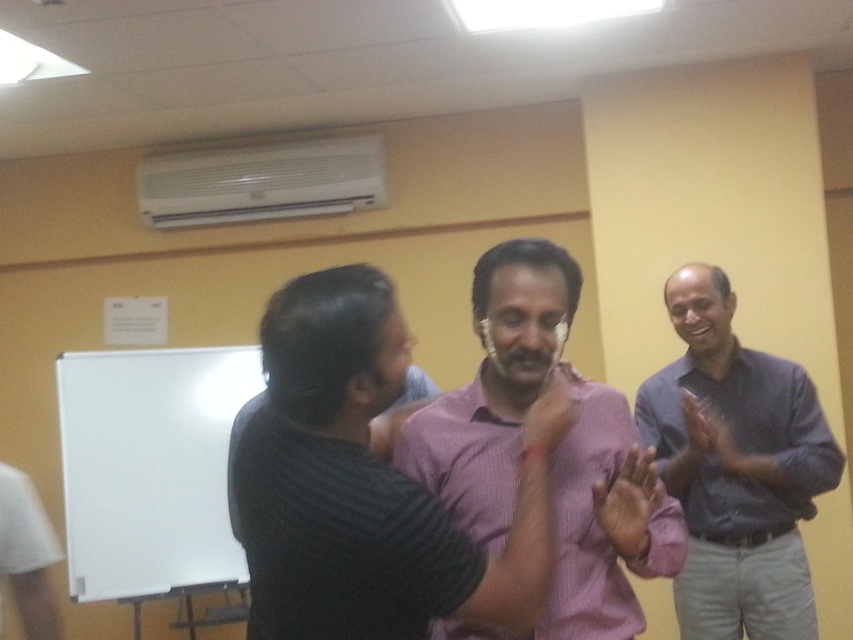
Question: Which point is closer to the camera?

Choices:
 (A) gray shirt at right
 (B) pink striped shirt at center
 (C) pink textured shirt at center

Answer: (B)

Question: Which of the following is the closest to the observer?

Choices:
 (A) pink textured shirt at center
 (B) gray shirt at right
 (C) pink striped shirt at center

Answer: (C)

Question: Is the position of pink striped shirt at center more distant than that of pink textured shirt at center?

Choices:
 (A) yes
 (B) no

Answer: (B)

Question: Estimate the real-world distances between objects in this image. Which object is closer to the pink striped shirt at center?

Choices:
 (A) pink textured shirt at center
 (B) gray shirt at right

Answer: (A)

Question: Can you confirm if pink striped shirt at center is bigger than pink textured shirt at center?

Choices:
 (A) yes
 (B) no

Answer: (A)

Question: Can you confirm if pink striped shirt at center is smaller than pink textured shirt at center?

Choices:
 (A) no
 (B) yes

Answer: (A)